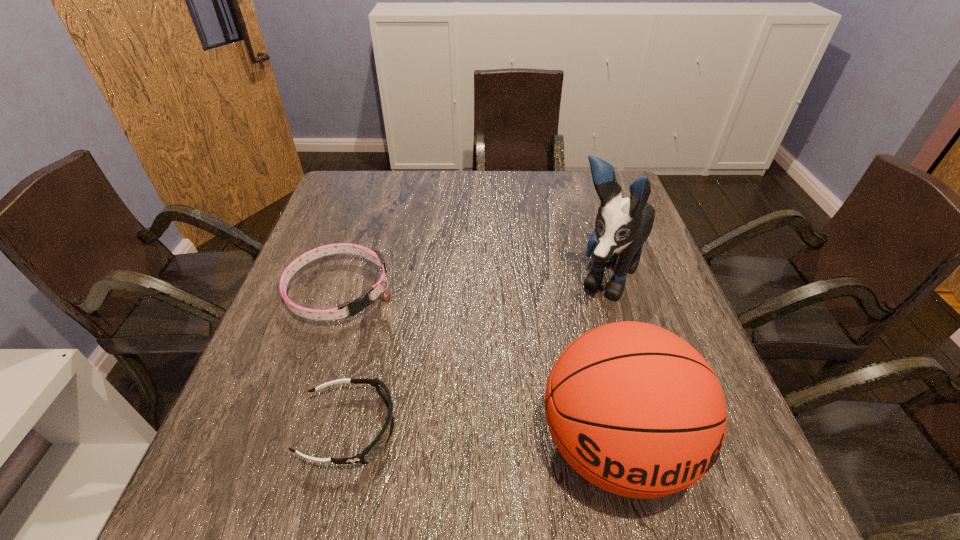
Locate an element on the screen. blank region between the basketball and the dog collar is located at coordinates (477, 369).

The width and height of the screenshot is (960, 540). Identify the location of unoccupied position between the dog collar and the puppy. (472, 285).

This screenshot has width=960, height=540. What are the coordinates of `free space between the dog collar and the second tallest object` in the screenshot? It's located at (477, 369).

Locate an element on the screen. empty space that is in between the dog collar and the basketball is located at coordinates (477, 369).

At what (x,y) coordinates should I click in order to perform the action: click on free space between the third shortest object and the shortest object. Please return your answer as a coordinate pair (x, y). Looking at the image, I should click on (482, 437).

I want to click on object that ranks as the second closest to the basketball, so click(x=370, y=452).

I want to click on object that is the third closest one to the shortest object, so click(x=623, y=224).

This screenshot has height=540, width=960. Find the location of `vacant area in the image that satisfies the following two spatial constraints: 1. on the front side of the shortest object; 2. on the front and sides of the dog collar`. vacant area in the image that satisfies the following two spatial constraints: 1. on the front side of the shortest object; 2. on the front and sides of the dog collar is located at coordinates (297, 428).